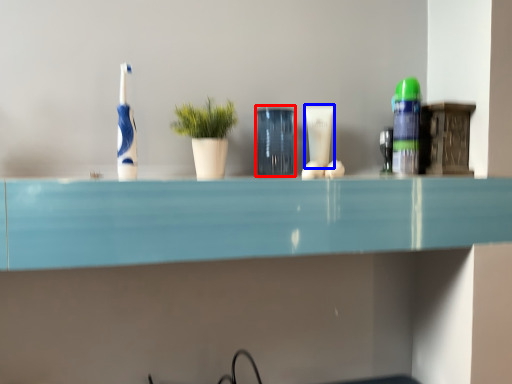
Question: Which object is further to the camera taking this photo, glass vase (highlighted by a red box) or toiletry (highlighted by a blue box)?

Choices:
 (A) glass vase
 (B) toiletry

Answer: (B)